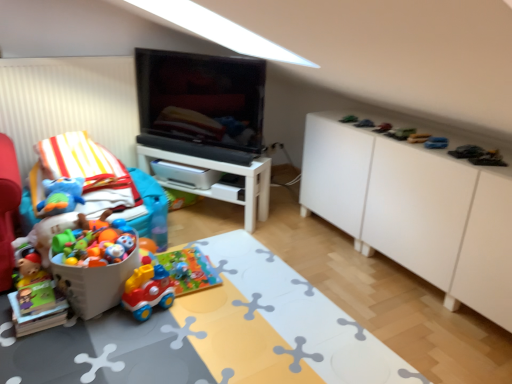
The image size is (512, 384). I want to click on vacant space to the right of white glossy table at center, placed as the 2th table when sorted from front to back, so click(x=291, y=229).